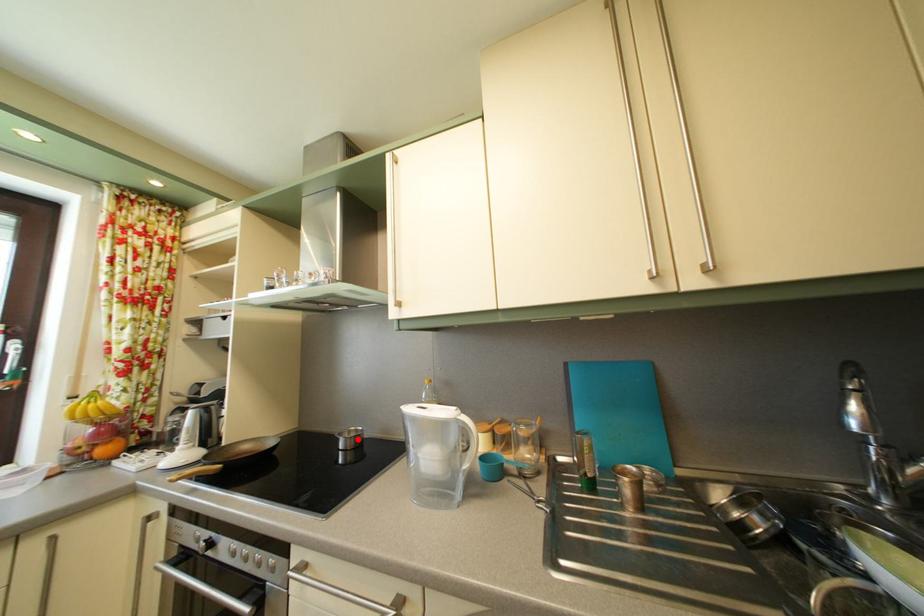
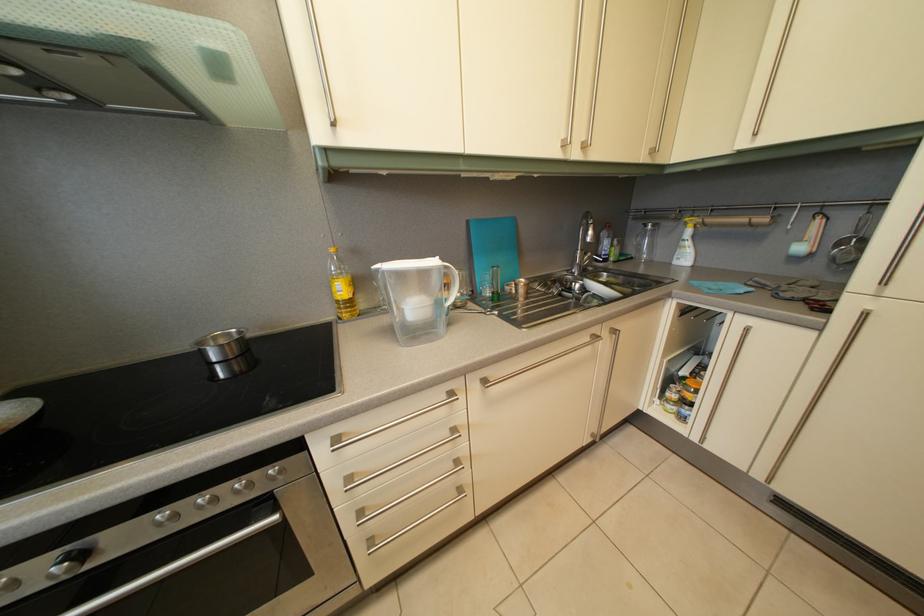
In the second image, find the point that corresponds to the highlighted location in the first image.

(224, 346)